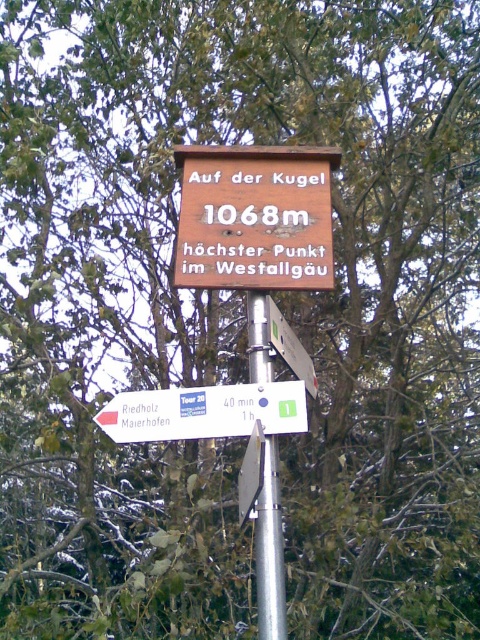
Question: Which is farther from the silver metallic pole at center?

Choices:
 (A) brown wooden sign at center
 (B) white plastic sign at lower left

Answer: (A)

Question: Based on their relative distances, which object is nearer to the white plastic sign at lower left?

Choices:
 (A) silver metallic pole at center
 (B) metallic silver sign at center

Answer: (A)

Question: Can you confirm if brown wooden sign at center is positioned to the right of silver metallic pole at center?

Choices:
 (A) yes
 (B) no

Answer: (B)

Question: Considering the relative positions of silver metallic pole at center and metallic silver sign at center in the image provided, where is silver metallic pole at center located with respect to metallic silver sign at center?

Choices:
 (A) left
 (B) right

Answer: (A)

Question: Among these points, which one is nearest to the camera?

Choices:
 (A) (201, 428)
 (B) (299, 348)
 (C) (272, 372)

Answer: (A)

Question: Does silver metallic pole at center appear over metallic silver sign at center?

Choices:
 (A) yes
 (B) no

Answer: (B)